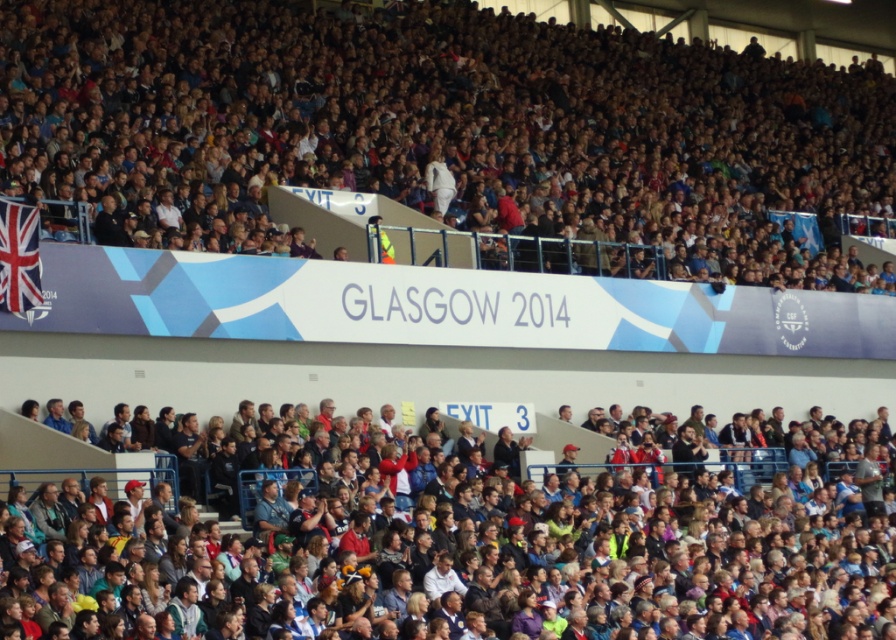
You are a photographer at the Glasgow 2014 event. You need to capture a photo that includes both the matte white banner at upper center and the multicolored fabric crowd at lower center. Which object should be placed higher in the frame to ensure both are visible?

The matte white banner at upper center should be placed higher in the frame because it is taller than the multicolored fabric crowd at lower center, ensuring both fit within the photo.

You are a photographer at the Glasgow 2014 event. You need to capture a photo that includes both the matte white banner at upper center and the multicolored fabric crowd at lower center. Which object will appear larger in your photo?

The matte white banner at upper center will appear larger in the photo because it is closer to the viewer than the multicolored fabric crowd at lower center.

You are an event planner reviewing the layout of the stadium. You need to place a new digital screen to display real time updates. The screen must be placed at the same location as the point marked at point (445, 125). What object will the new screen overlap with?

The new screen will overlap with the matte white banner at upper center, as point (445, 125) marks its location.